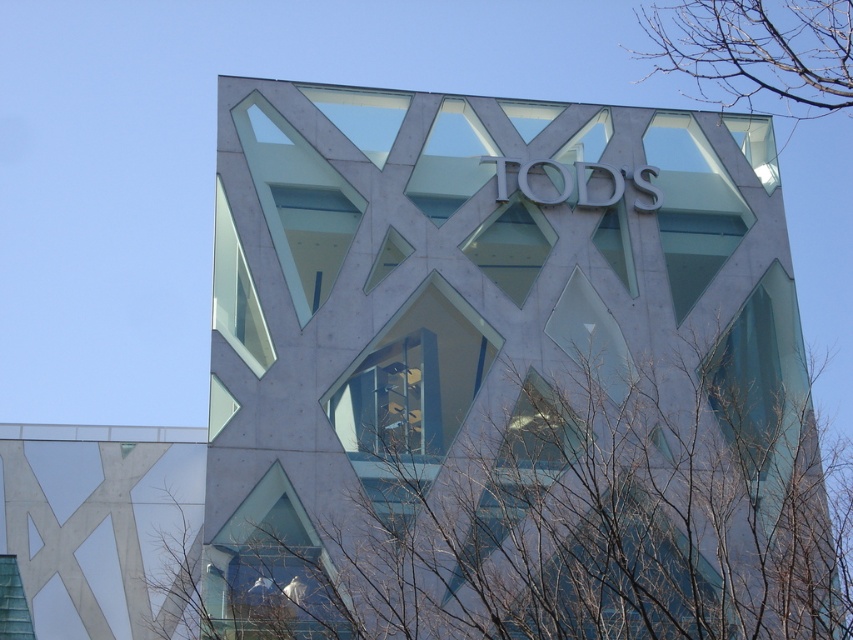
Question: Which point is closer to the camera?

Choices:
 (A) (758, 70)
 (B) (547, 412)

Answer: (B)

Question: Among these objects, which one is farthest from the camera?

Choices:
 (A) bare branches at lower left
 (B) bare branches at upper right

Answer: (B)

Question: Can you confirm if bare branches at lower left is thinner than bare branches at upper right?

Choices:
 (A) yes
 (B) no

Answer: (B)

Question: Is bare branches at lower left above bare branches at upper right?

Choices:
 (A) no
 (B) yes

Answer: (A)

Question: Can you confirm if bare branches at lower left is thinner than bare branches at upper right?

Choices:
 (A) no
 (B) yes

Answer: (A)